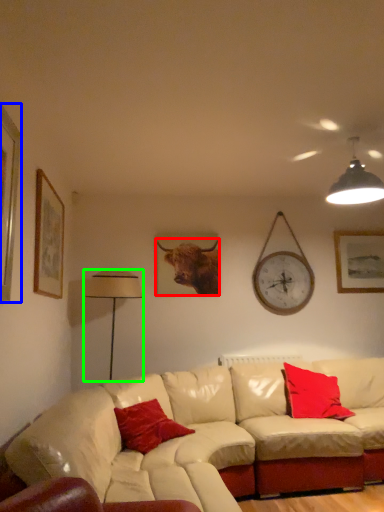
Question: Which object is the farthest from cattle (highlighted by a red box)? Choose among these: picture frame (highlighted by a blue box) or table lamp (highlighted by a green box).

Choices:
 (A) picture frame
 (B) table lamp

Answer: (A)